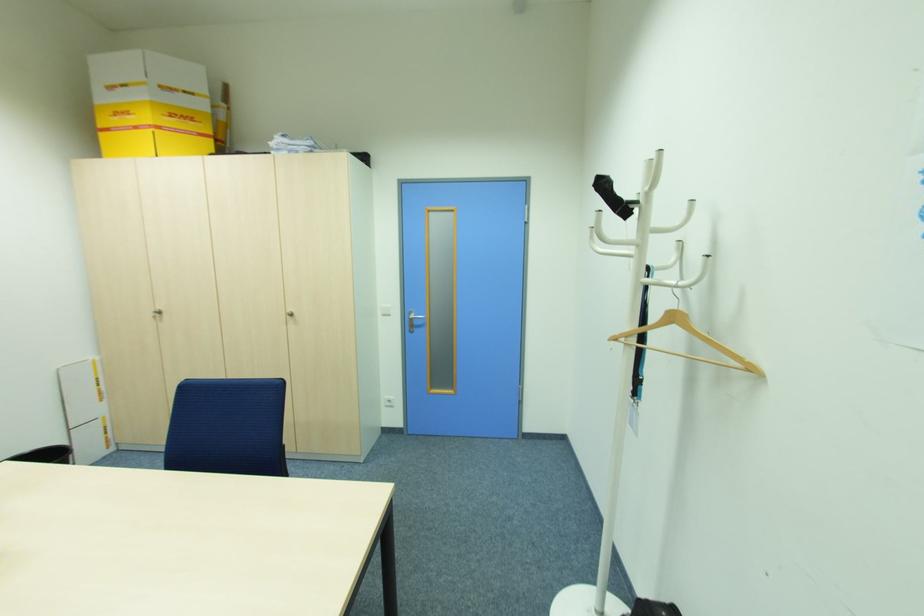
Describe the element at coordinates (414, 320) in the screenshot. Image resolution: width=924 pixels, height=616 pixels. I see `the silver door handle` at that location.